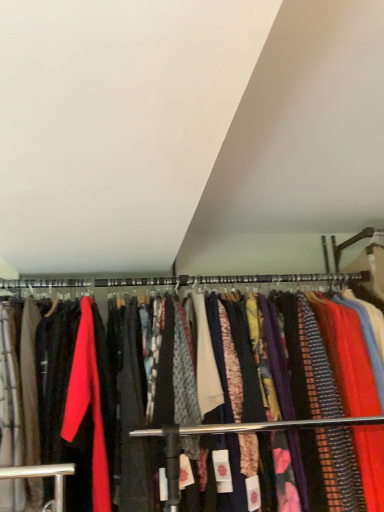
Describe the element at coordinates (264, 426) in the screenshot. I see `matte red dress at center` at that location.

Identify the location of matte red dress at center. (264, 426).

Identify the location of matte red dress at center. (264, 426).